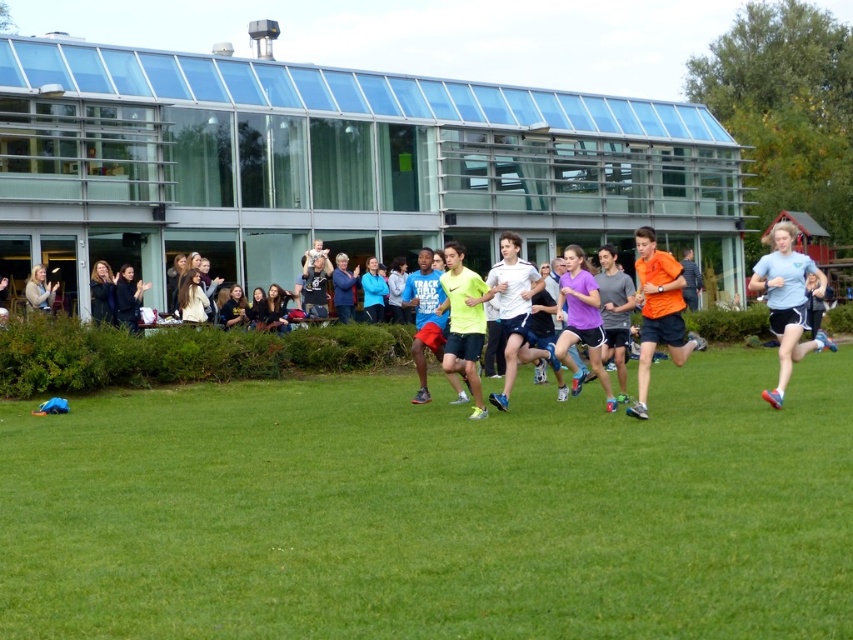
Question: From the image, what is the correct spatial relationship of matte black jacket at left in relation to blue fabric jacket at center?

Choices:
 (A) right
 (B) left

Answer: (B)

Question: Does orange matte shorts at center have a larger size compared to matte black shirt at center?

Choices:
 (A) yes
 (B) no

Answer: (A)

Question: Is the position of green grass at lower center less distant than that of matte black shirt at center?

Choices:
 (A) yes
 (B) no

Answer: (A)

Question: Considering the real-world distances, which object is closest to the light brown hair at center?

Choices:
 (A) dark blue fabric jacket at left
 (B) light brown hair at left
 (C) orange matte shorts at center
 (D) neon yellow running shirt at center

Answer: (A)

Question: Which of the following is the closest to the observer?

Choices:
 (A) (480, 400)
 (B) (624, 356)
 (C) (178, 296)
 (D) (335, 275)

Answer: (A)

Question: Which point is farther to the camera?

Choices:
 (A) light brown hair at left
 (B) light brown hair at center
 (C) dark blue fabric jacket at left
 (D) matte black jacket at left

Answer: (B)